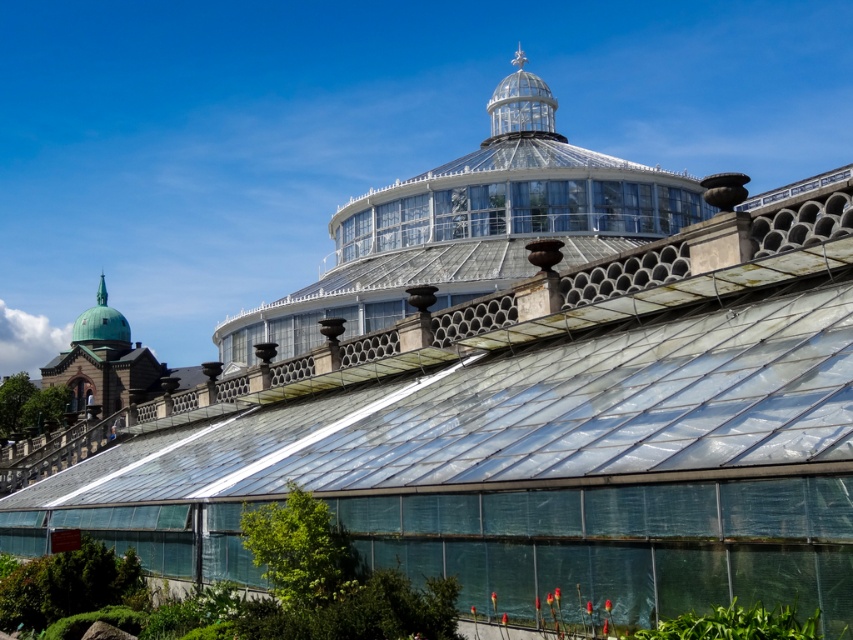
Question: Is transparent plastic garden at lower center below green copper dome at upper left?

Choices:
 (A) no
 (B) yes

Answer: (B)

Question: Which object is positioned closest to the transparent glass dome at center?

Choices:
 (A) green copper dome at upper left
 (B) transparent plastic garden at lower center

Answer: (B)

Question: Based on their relative distances, which object is nearer to the transparent plastic garden at lower center?

Choices:
 (A) transparent glass dome at center
 (B) green copper dome at upper left

Answer: (A)

Question: Can you confirm if transparent glass dome at center is smaller than transparent plastic garden at lower center?

Choices:
 (A) no
 (B) yes

Answer: (A)

Question: Does transparent glass dome at center have a lesser width compared to transparent plastic garden at lower center?

Choices:
 (A) no
 (B) yes

Answer: (A)

Question: Which object appears farthest from the camera in this image?

Choices:
 (A) transparent glass dome at center
 (B) green copper dome at upper left
 (C) transparent plastic garden at lower center

Answer: (B)